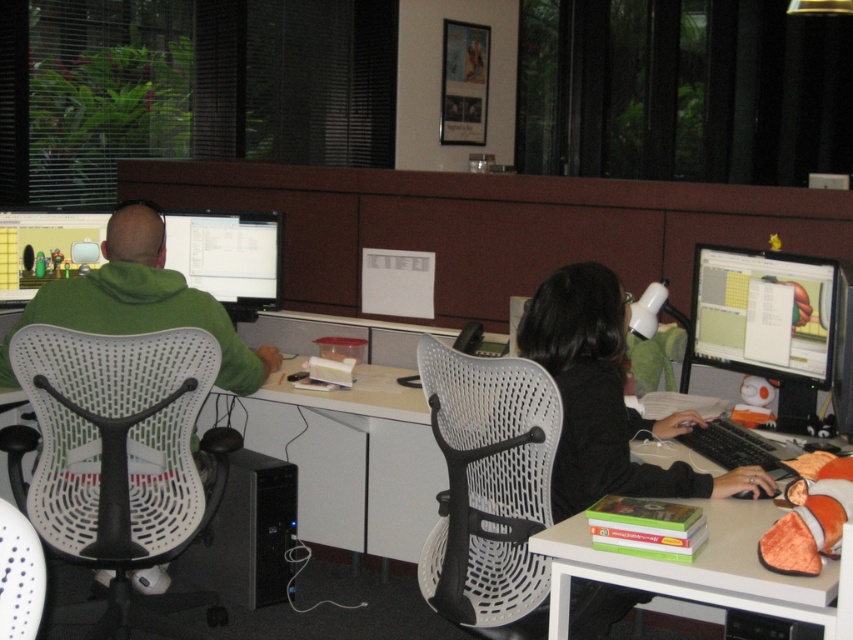
You are standing in the office and want to sit down at the computer. There is a white mesh swivel chair at left and a matte plastic monitor at right. Which object should you approach first to sit in the chair?

You should approach the white mesh swivel chair at left first because it is positioned on the left side of the matte plastic monitor at right, meaning it is closer to your current position if you are facing the setup from the front.

You are an office worker who needs to choose a chair for a meeting. You prefer a larger chair for comfort. Based on the scene, which chair between the white mesh swivel chair at left and the white mesh swivel chair at center should you choose?

You should choose the white mesh swivel chair at left because it is larger in size than the white mesh swivel chair at center.

You are a delivery person who just arrived at the office. You need to place a new monitor that is 25 cm tall on a desk. Looking at the scene, which object can you use as a reference to ensure the new monitor will fit vertically between the white mesh swivel chair at left and the matte black monitor at center?

The white mesh swivel chair at left is taller than the matte black monitor at center. Since the new monitor is 25 cm tall, you should compare its height with the shorter object, which is the matte black monitor at center. If the new monitor is shorter than the matte black monitor at center, it will fit vertically between them.